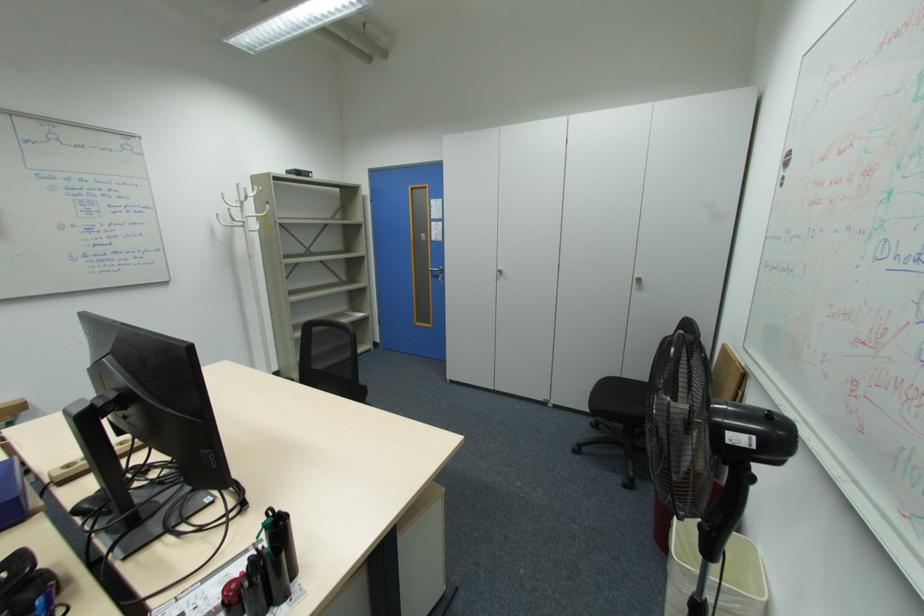
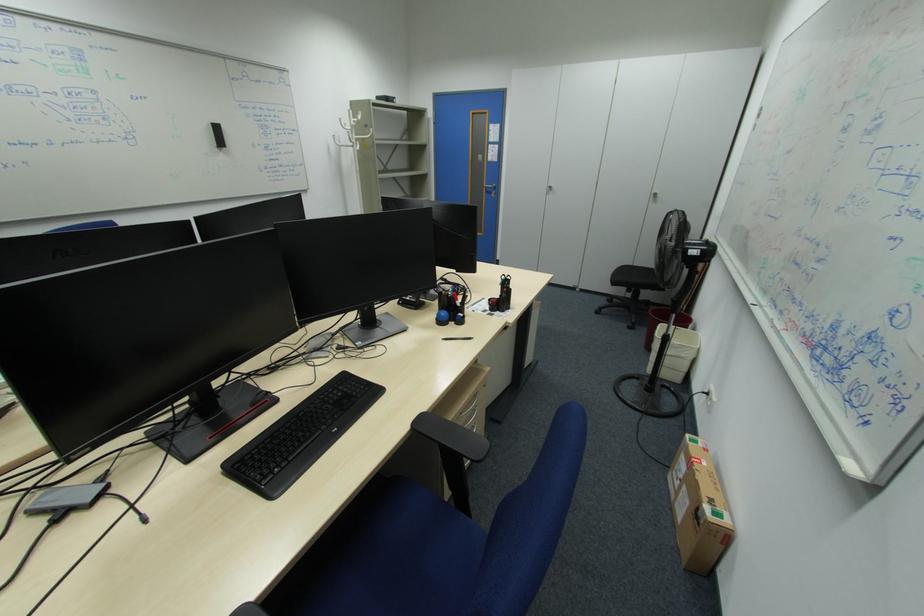
What movement of the cameraman would produce the second image?

The cameraman moved toward left, backward.